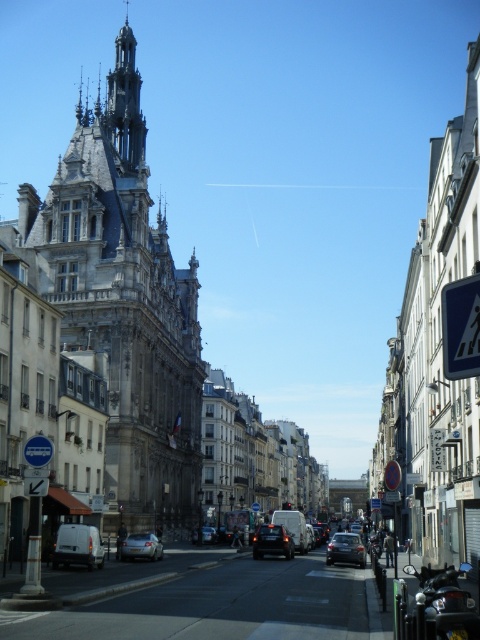
You are standing at the center of the street in the image. Which direction should you look to see the silver metallic car at lower left?

The silver metallic car at lower left is located at coordinates point [141,547], which is to the lower left direction from your current position at the center of the street.

You are a photographer trying to capture the stone gothic tower at upper left and the shiny silver car at center in a single shot. Which object will appear larger in the photo if you frame the shot to include both?

The stone gothic tower at upper left will appear larger in the photo because it is taller than the shiny silver car at center.

You are a pedestrian standing at the crosswalk in the middle of the street. You see a silver metallic car at lower left and a shiny silver car at center. Which car is closer to your left side?

The silver metallic car at lower left is to the left of the shiny silver car at center, so it is closer to your left side.